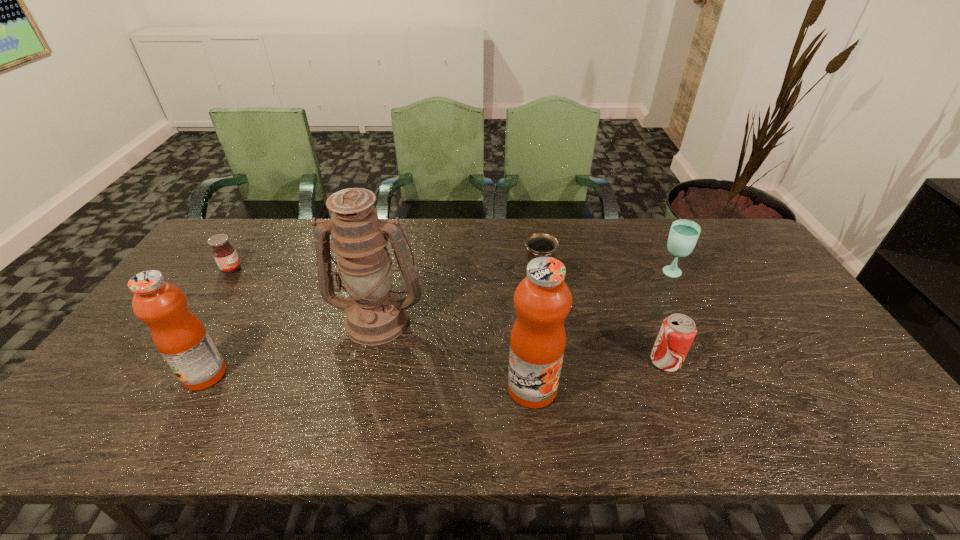
Identify the location of the closest object to the leftmost object. The image size is (960, 540). (180, 337).

Select which object appears as the fifth closest to the rightmost object. Please provide its 2D coordinates. Your answer should be formatted as a tuple, i.e. [(x, y)], where the tuple contains the x and y coordinates of a point satisfying the conditions above.

[(180, 337)]

Where is `vacant space that satisfies the following two spatial constraints: 1. on the back side of the second object from right to left; 2. on the left side of the rightmost object`? vacant space that satisfies the following two spatial constraints: 1. on the back side of the second object from right to left; 2. on the left side of the rightmost object is located at coordinates (631, 273).

You are a GUI agent. You are given a task and a screenshot of the screen. Output one action in this format:
    pyautogui.click(x=<x>, y=<y>)
    Task: Click on the vacant space that satisfies the following two spatial constraints: 1. on the label side of the leftmost object; 2. on the left side of the soda can
    Image resolution: width=960 pixels, height=540 pixels.
    Given the screenshot: What is the action you would take?
    pyautogui.click(x=171, y=362)

You are a GUI agent. You are given a task and a screenshot of the screen. Output one action in this format:
    pyautogui.click(x=<x>, y=<y>)
    Task: Click on the vacant position in the image that satisfies the following two spatial constraints: 1. on the back side of the chalice; 2. on the left side of the third object from left to right
    The image size is (960, 540).
    Given the screenshot: What is the action you would take?
    point(385,289)

I want to click on vacant region that satisfies the following two spatial constraints: 1. on the back side of the oil lamp; 2. on the label side of the shortest object, so click(390, 269).

Locate an element on the screen. Image resolution: width=960 pixels, height=540 pixels. vacant area in the image that satisfies the following two spatial constraints: 1. on the back side of the rightmost object; 2. on the label side of the shortest object is located at coordinates [x=668, y=269].